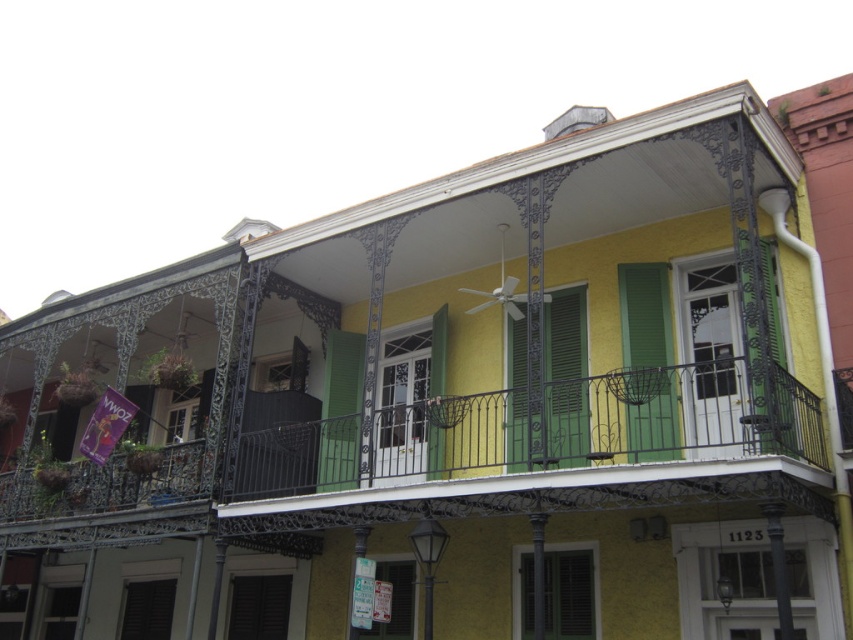
Question: Which point is closer to the camera taking this photo?

Choices:
 (A) (560, 440)
 (B) (659, 477)

Answer: (B)

Question: Where is green wrought iron balcony at center located in relation to green matte shutter at center in the image?

Choices:
 (A) right
 (B) left

Answer: (B)

Question: Can you confirm if green wrought iron balcony at center is positioned to the left of green matte shutter at center?

Choices:
 (A) no
 (B) yes

Answer: (B)

Question: Among these objects, which one is farthest from the camera?

Choices:
 (A) green matte shutter at center
 (B) green wrought iron balcony at center

Answer: (A)

Question: Among these points, which one is nearest to the camera?

Choices:
 (A) (416, 452)
 (B) (561, 397)

Answer: (B)

Question: Can you confirm if green wrought iron balcony at center is wider than green matte shutter at center?

Choices:
 (A) yes
 (B) no

Answer: (A)